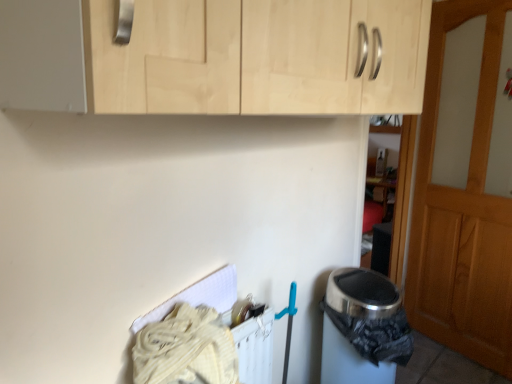
This screenshot has width=512, height=384. Describe the element at coordinates (218, 57) in the screenshot. I see `light wood cabinet at upper center` at that location.

This screenshot has height=384, width=512. Identify the location of wooden door at right. (465, 186).

Considering the relative positions of wooden door at right and light wood cabinet at upper center in the image provided, is wooden door at right to the right of light wood cabinet at upper center from the viewer's perspective?

Correct, you'll find wooden door at right to the right of light wood cabinet at upper center.

Considering the sizes of objects wooden door at right and light wood cabinet at upper center in the image provided, who is wider, wooden door at right or light wood cabinet at upper center?

light wood cabinet at upper center.

Is light wood cabinet at upper center located within wooden door at right?

No, light wood cabinet at upper center is not a part of wooden door at right.

Between light wood cabinet at upper center and metallic trash can at lower right, which one has larger width?

metallic trash can at lower right is wider.

How many degrees apart are the facing directions of light wood cabinet at upper center and metallic trash can at lower right?

light wood cabinet at upper center and metallic trash can at lower right are facing 0.00249 degrees away from each other.

Based on their positions, is light wood cabinet at upper center located to the left or right of metallic trash can at lower right?

In the image, light wood cabinet at upper center appears on the left side of metallic trash can at lower right.

In the scene shown: Between metallic trash can at lower right and light wood cabinet at upper center, which one has larger size?

light wood cabinet at upper center.

Does metallic trash can at lower right come in front of light wood cabinet at upper center?

No, metallic trash can at lower right is further to the viewer.

Locate an element on the screen. cabinetry on the left of metallic trash can at lower right is located at coordinates (218, 57).

Based on the photo, from their relative heights in the image, would you say metallic trash can at lower right is taller or shorter than light wood cabinet at upper center?

Clearly, metallic trash can at lower right is taller compared to light wood cabinet at upper center.

Does wooden door at right have a larger size compared to metallic trash can at lower right?

Yes, wooden door at right is bigger than metallic trash can at lower right.

From the image's perspective, is wooden door at right above or below metallic trash can at lower right?

Clearly, from the image's perspective, wooden door at right is above metallic trash can at lower right.

This screenshot has width=512, height=384. What are the coordinates of `door above the metallic trash can at lower right (from the image's perspective)` in the screenshot? It's located at (465, 186).

Is wooden door at right located outside metallic trash can at lower right?

Yes, wooden door at right is not within metallic trash can at lower right.

Which object is more forward, light wood cabinet at upper center or wooden door at right?

light wood cabinet at upper center is more forward.

From the image's perspective, is light wood cabinet at upper center positioned above or below wooden door at right?

light wood cabinet at upper center is above wooden door at right.

Is wooden door at right surrounded by light wood cabinet at upper center?

No, wooden door at right is not surrounded by light wood cabinet at upper center.

Identify the location of cabinetry in front of the wooden door at right. (218, 57).

From the image's perspective, is metallic trash can at lower right above wooden door at right?

No, from the image's perspective, metallic trash can at lower right is not over wooden door at right.

Between metallic trash can at lower right and wooden door at right, which one appears on the right side from the viewer's perspective?

From the viewer's perspective, wooden door at right appears more on the right side.

Does metallic trash can at lower right have a greater height compared to wooden door at right?

In fact, metallic trash can at lower right may be shorter than wooden door at right.

Who is bigger, metallic trash can at lower right or wooden door at right?

With larger size is wooden door at right.

You are a GUI agent. You are given a task and a screenshot of the screen. Output one action in this format:
    pyautogui.click(x=<x>, y=<y>)
    Task: Click on the door below the light wood cabinet at upper center (from the image's perspective)
    
    Given the screenshot: What is the action you would take?
    pyautogui.click(x=465, y=186)

You are a GUI agent. You are given a task and a screenshot of the screen. Output one action in this format:
    pyautogui.click(x=<x>, y=<y>)
    Task: Click on the cabinetry lying in front of the metallic trash can at lower right
    The width and height of the screenshot is (512, 384).
    Given the screenshot: What is the action you would take?
    pyautogui.click(x=218, y=57)

When comparing their distances from metallic trash can at lower right, does light wood cabinet at upper center or wooden door at right seem further?

wooden door at right.

Considering their positions, is wooden door at right positioned further to light wood cabinet at upper center than metallic trash can at lower right?

wooden door at right.

From the image, which object appears to be nearer to wooden door at right, metallic trash can at lower right or light wood cabinet at upper center?

metallic trash can at lower right is closer to wooden door at right.

Estimate the real-world distances between objects in this image. Which object is closer to metallic trash can at lower right, wooden door at right or light wood cabinet at upper center?

light wood cabinet at upper center is positioned closer to the anchor metallic trash can at lower right.

Which object lies nearer to the anchor point light wood cabinet at upper center, metallic trash can at lower right or wooden door at right?

Among the two, metallic trash can at lower right is located nearer to light wood cabinet at upper center.

Considering their positions, is light wood cabinet at upper center positioned further to wooden door at right than metallic trash can at lower right?

light wood cabinet at upper center lies further to wooden door at right than the other object.

You are a GUI agent. You are given a task and a screenshot of the screen. Output one action in this format:
    pyautogui.click(x=<x>, y=<y>)
    Task: Click on the appliance positioned between light wood cabinet at upper center and wooden door at right from near to far
    The image size is (512, 384).
    Given the screenshot: What is the action you would take?
    pyautogui.click(x=359, y=326)